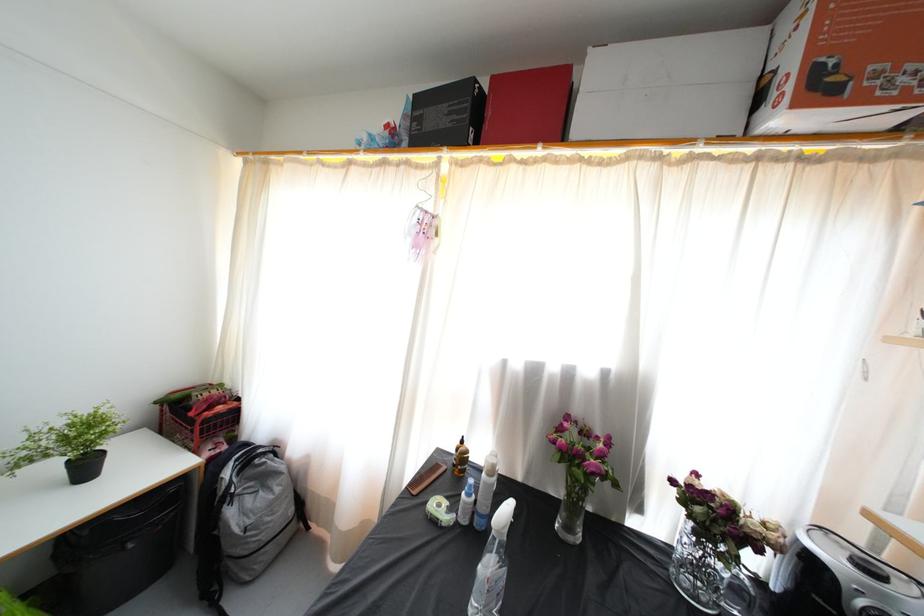
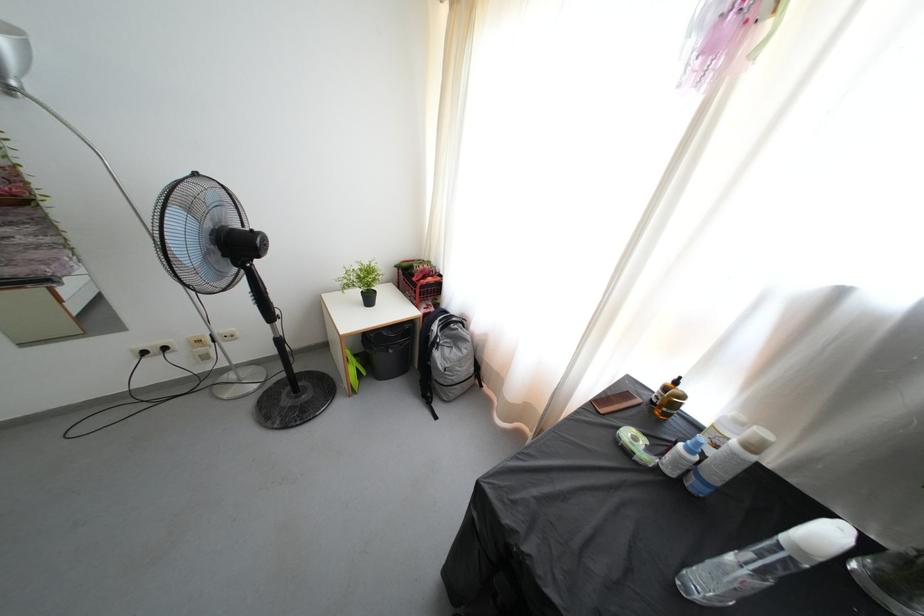
Where in the second image is the point corresponding to [439,528] from the first image?

(631, 458)